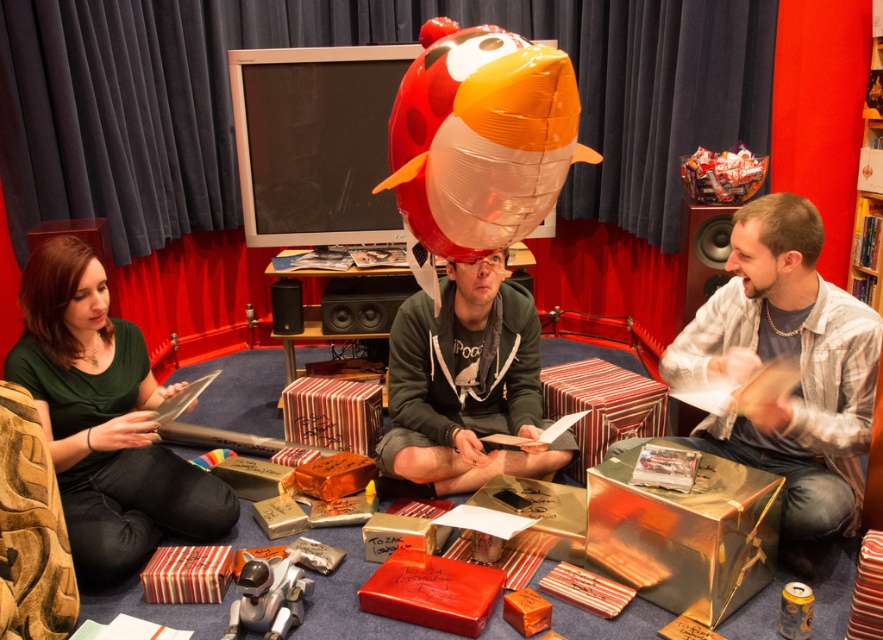
In the scene shown: You are standing at the entrance of the room and want to greet the metallic silver robot at lower center. Which direction should you walk to reach it?

Walk towards the lower center direction to reach the metallic silver robot at lower center.

You are a delivery drone that needs to land in this room. The metallic silver robot at lower center and the matte black speaker at center are in your landing path. Based on their heights, can you safely land between them without hitting either?

The metallic silver robot at lower center is shorter than the matte black speaker at center. Since the robot is shorter, the drone can likely pass over it and under the speaker, but the height difference might require careful navigation. However, without knowing the exact clearance needed, it is uncertain. The safest assumption is that landing between them may not be possible due to the speaker being taller.

You are a guest at a party in this room and want to take a photo of the metallic silver robot at lower center and the matte black speaker at right. Which object should you focus on first to ensure both are in the frame?

You should focus on the metallic silver robot at lower center first because it is closer to the viewer than the matte black speaker at right, so adjusting the camera to include both would require starting with the closer object.